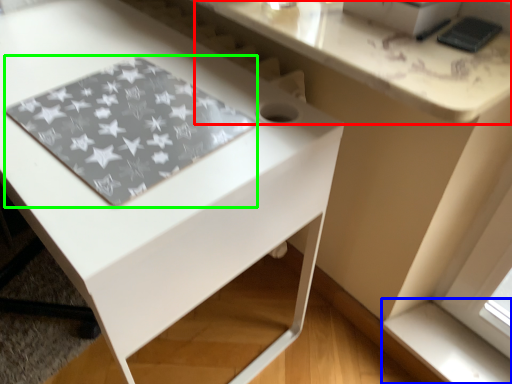
Question: Based on their relative distances, which object is nearer to counter top (highlighted by a red box)? Choose from window sill (highlighted by a blue box) and mat (highlighted by a green box).

Choices:
 (A) window sill
 (B) mat

Answer: (B)